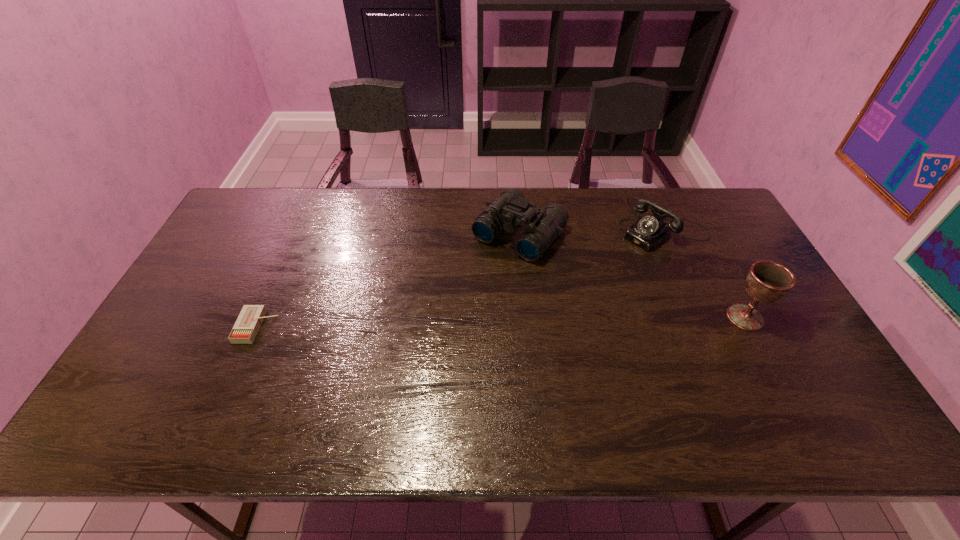
In order to click on matchbox in this screenshot , I will do `click(244, 331)`.

The width and height of the screenshot is (960, 540). Identify the location of the shortest object. (244, 331).

I want to click on chalice, so tap(767, 281).

Where is `binoculars`? binoculars is located at coordinates (543, 225).

At what (x,y) coordinates should I click in order to perform the action: click on the third tallest object. Please return your answer as a coordinate pair (x, y). Looking at the image, I should click on (649, 232).

Locate an element on the screen. free space located 0.250m on the striking surface of the leftmost object is located at coordinates (367, 327).

I want to click on vacant region located on the left of the chalice, so click(x=632, y=317).

At what (x,y) coordinates should I click in order to perform the action: click on blank area located 0.280m through the lenses of the second object from left to right. Please return your answer as a coordinate pair (x, y). This screenshot has height=540, width=960. Looking at the image, I should click on (443, 322).

Where is `vacant region located through the lenses of the second object from left to right`? vacant region located through the lenses of the second object from left to right is located at coordinates click(444, 320).

Locate an element on the screen. Image resolution: width=960 pixels, height=540 pixels. vacant space located through the lenses of the second object from left to right is located at coordinates (457, 305).